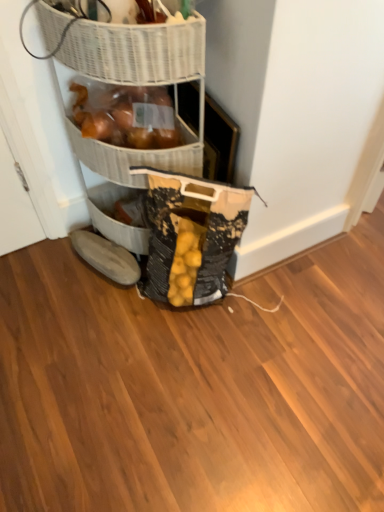
Question: Does textured canvas bag at lower center turn towards brown suede boot at lower left?

Choices:
 (A) no
 (B) yes

Answer: (A)

Question: From the image's perspective, is textured canvas bag at lower center located above brown suede boot at lower left?

Choices:
 (A) yes
 (B) no

Answer: (A)

Question: Does textured canvas bag at lower center come behind brown suede boot at lower left?

Choices:
 (A) no
 (B) yes

Answer: (A)

Question: Is textured canvas bag at lower center in front of brown suede boot at lower left?

Choices:
 (A) no
 (B) yes

Answer: (B)

Question: Is textured canvas bag at lower center thinner than brown suede boot at lower left?

Choices:
 (A) no
 (B) yes

Answer: (A)

Question: Considering the positions of white wicker basket at upper left, marked as the first basket in a front-to-back arrangement, and textured canvas bag at lower center in the image, is white wicker basket at upper left, marked as the first basket in a front-to-back arrangement, wider or thinner than textured canvas bag at lower center?

Choices:
 (A) thin
 (B) wide

Answer: (B)

Question: Considering the positions of white wicker basket at upper left, marked as the first basket in a front-to-back arrangement, and textured canvas bag at lower center in the image, is white wicker basket at upper left, marked as the first basket in a front-to-back arrangement, bigger or smaller than textured canvas bag at lower center?

Choices:
 (A) small
 (B) big

Answer: (A)

Question: In terms of height, does white wicker basket at upper left, marked as the first basket in a front-to-back arrangement, look taller or shorter compared to textured canvas bag at lower center?

Choices:
 (A) tall
 (B) short

Answer: (B)

Question: Is point (170, 49) positioned closer to the camera than point (168, 232)?

Choices:
 (A) closer
 (B) farther

Answer: (A)

Question: In the image, is brown suede boot at lower left on the left side or the right side of white wicker basket at upper left, marked as the first basket in a front-to-back arrangement?

Choices:
 (A) right
 (B) left

Answer: (B)

Question: Is brown suede boot at lower left bigger or smaller than white wicker basket at upper left, which is counted as the second basket, starting from the back?

Choices:
 (A) big
 (B) small

Answer: (B)

Question: From the image's perspective, is brown suede boot at lower left positioned above or below white wicker basket at upper left, which is counted as the second basket, starting from the back?

Choices:
 (A) below
 (B) above

Answer: (A)

Question: Is point (107, 268) positioned closer to the camera than point (39, 5)?

Choices:
 (A) closer
 (B) farther

Answer: (B)

Question: From the image's perspective, is textured canvas bag at lower center located above or below white wicker basket at upper left, marked as the first basket in a front-to-back arrangement?

Choices:
 (A) above
 (B) below

Answer: (B)

Question: Visually, is textured canvas bag at lower center positioned to the left or to the right of white wicker basket at upper left, which is counted as the second basket, starting from the back?

Choices:
 (A) right
 (B) left

Answer: (A)